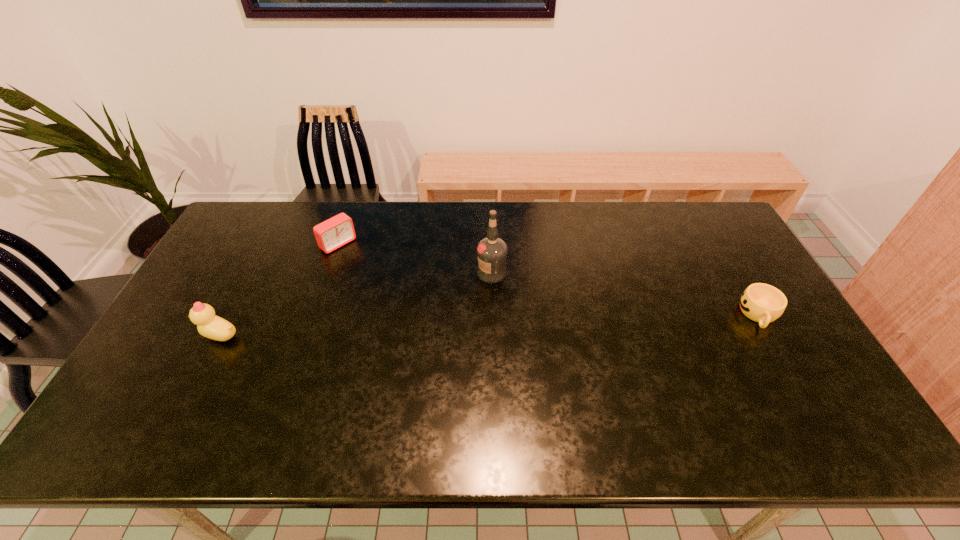
Find the location of a particular element. The height and width of the screenshot is (540, 960). vacant space on the desktop that is between the leftmost object and the rightmost object and is positioned on the front label of the tallest object is located at coordinates (453, 326).

In order to click on vacant space on the desktop that is between the second tallest object and the rightmost object and is positioned on the front-facing side of the farthest object in this screenshot , I will do `click(438, 327)`.